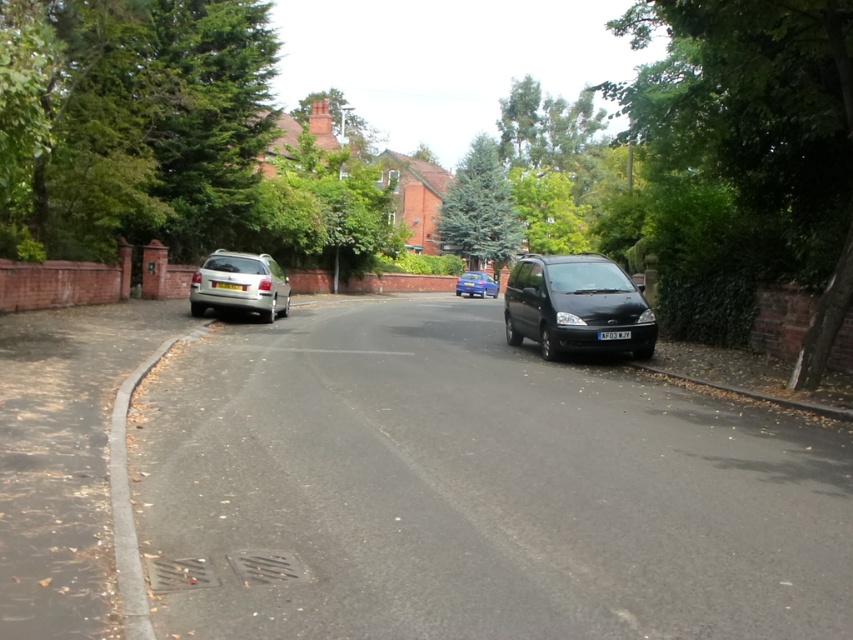
You are a delivery person trying to park your black matte van at center in the residential area. There is a gray concrete driveway at lower left nearby. Can you park the van on the driveway without blocking the road?

The gray concrete driveway at lower left is below the black matte van at center, so parking the van on the driveway would block the road since the driveway is positioned lower than the van.